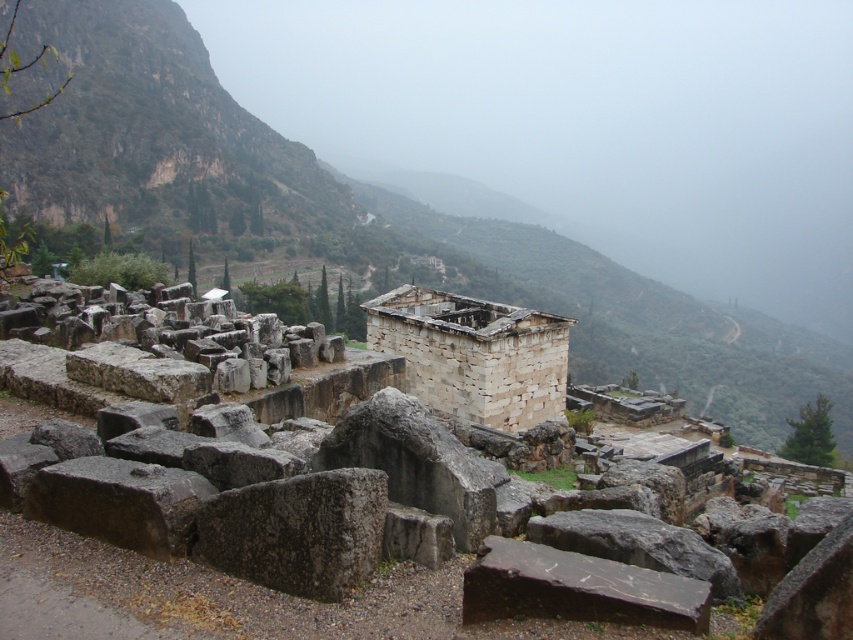
Question: Which point is closer to the camera?

Choices:
 (A) gray stone mountain at upper left
 (B) rugged stone mountain at upper left
 (C) white stone building at center
 (D) gray stone wall at center

Answer: (D)

Question: From the image, what is the correct spatial relationship of rugged stone mountain at upper left in relation to white stone building at center?

Choices:
 (A) left
 (B) right

Answer: (A)

Question: Which of the following is the farthest from the observer?

Choices:
 (A) (318, 387)
 (B) (381, 307)
 (C) (640, 385)
 (D) (344, 218)

Answer: (D)

Question: Does gray stone mountain at upper left have a lesser width compared to rugged stone mountain at upper left?

Choices:
 (A) yes
 (B) no

Answer: (B)

Question: Among these points, which one is nearest to the camera?

Choices:
 (A) (482, 308)
 (B) (140, 182)

Answer: (A)

Question: Can you confirm if gray stone mountain at upper left is positioned to the left of gray stone wall at center?

Choices:
 (A) yes
 (B) no

Answer: (B)